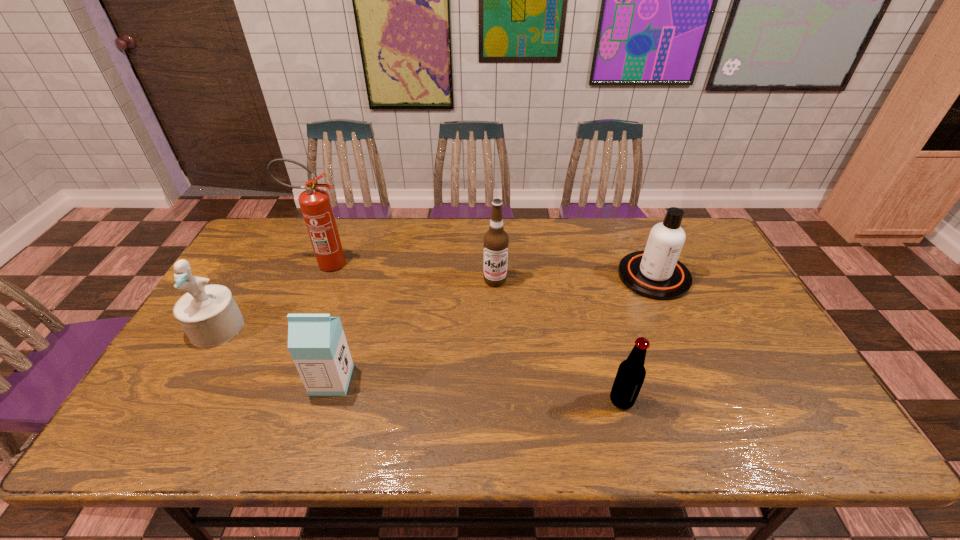
Locate an element on the screen. The width and height of the screenshot is (960, 540). vacant space that satisfies the following two spatial constraints: 1. from the nozzle of the beer bottle; 2. on the left side of the fire extinguisher is located at coordinates (271, 400).

Identify the location of free space that satisfies the following two spatial constraints: 1. from the nozzle of the milk carton; 2. on the right side of the fire extinguisher. The image size is (960, 540). (278, 380).

Identify the location of vacant region that satisfies the following two spatial constraints: 1. from the nozzle of the fourth object from right to left; 2. on the right side of the fire extinguisher. (278, 380).

The width and height of the screenshot is (960, 540). In order to click on free space that satisfies the following two spatial constraints: 1. on the label of the second tallest object; 2. on the right side of the beer bottle in this screenshot , I will do `click(499, 400)`.